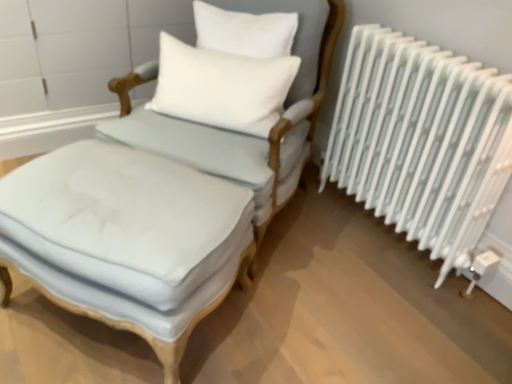
Question: From the image's perspective, relative to light blue fabric chair at center, is light blue fabric armchair at center above or below?

Choices:
 (A) above
 (B) below

Answer: (A)

Question: In the image, is light blue fabric armchair at center on the left side or the right side of light blue fabric chair at center?

Choices:
 (A) left
 (B) right

Answer: (B)

Question: Which object is the closest to the light blue fabric armchair at center?

Choices:
 (A) light blue fabric ottoman at center
 (B) light blue fabric chair at center
 (C) white metal radiator at right
 (D) white soft cushion at upper center

Answer: (B)

Question: Which object is the closest to the light blue fabric armchair at center?

Choices:
 (A) light blue fabric ottoman at center
 (B) white metal radiator at right
 (C) white soft cushion at upper center
 (D) light blue fabric chair at center

Answer: (D)